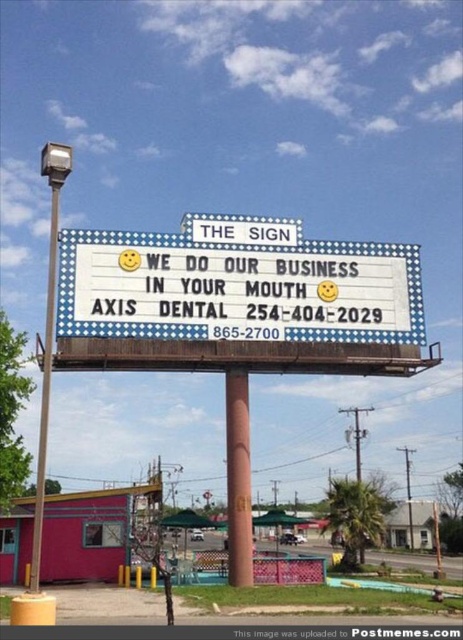
You are standing in front of the billboard and want to take a photo of both the brown painted wood pole at center and the metallic pole at left. Which pole should you position yourself closer to in order to capture both in the frame?

You should position yourself closer to the metallic pole at left because the brown painted wood pole at center is positioned on the right side of it, allowing both poles to be in the frame when closer to the left pole.

You are standing in front of the billboard and want to touch both the white plastic marquee board at center and the metallic pole at left. Which object will you reach first?

You will reach the white plastic marquee board at center first because it is closer to you than the metallic pole at left, which is further away.

You are standing in front of the billboard and want to take a photo of the brown painted wood pole at center without the white plastic marquee board at center blocking it. Is this possible?

The white plastic marquee board at center is in front of the brown painted wood pole at center, so it is blocking the view. To take a photo of the brown painted wood pole at center without the white plastic marquee board at center, you would need to move to a position where the pole is not behind the board or adjust your angle to avoid the board.